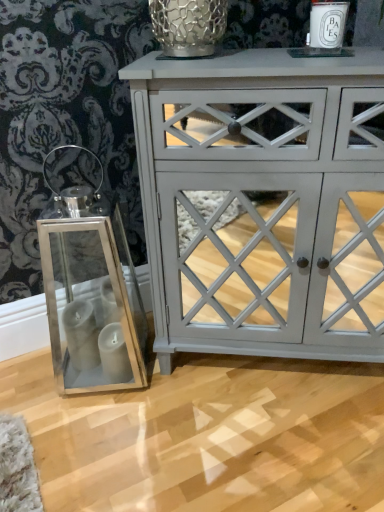
Question: Is the depth of metallic mesh glass vase at upper center less than that of matte gray cabinet at center?

Choices:
 (A) no
 (B) yes

Answer: (A)

Question: Is metallic mesh glass vase at upper center further to the viewer compared to matte gray cabinet at center?

Choices:
 (A) no
 (B) yes

Answer: (B)

Question: Does metallic mesh glass vase at upper center have a smaller size compared to matte gray cabinet at center?

Choices:
 (A) no
 (B) yes

Answer: (B)

Question: Does metallic mesh glass vase at upper center have a lesser height compared to matte gray cabinet at center?

Choices:
 (A) yes
 (B) no

Answer: (A)

Question: Can matte gray cabinet at center be found inside metallic mesh glass vase at upper center?

Choices:
 (A) yes
 (B) no

Answer: (B)

Question: Does metallic mesh glass vase at upper center touch matte gray cabinet at center?

Choices:
 (A) yes
 (B) no

Answer: (B)

Question: Can metallic mesh glass vase at upper center be found inside white ceramic candle at upper right?

Choices:
 (A) no
 (B) yes

Answer: (A)

Question: Can you confirm if white ceramic candle at upper right is shorter than metallic mesh glass vase at upper center?

Choices:
 (A) yes
 (B) no

Answer: (A)

Question: Is white ceramic candle at upper right located outside metallic mesh glass vase at upper center?

Choices:
 (A) yes
 (B) no

Answer: (A)

Question: Does white ceramic candle at upper right turn towards metallic mesh glass vase at upper center?

Choices:
 (A) yes
 (B) no

Answer: (B)

Question: Is white ceramic candle at upper right positioned before metallic mesh glass vase at upper center?

Choices:
 (A) yes
 (B) no

Answer: (A)

Question: From a real-world perspective, is white ceramic candle at upper right positioned over metallic mesh glass vase at upper center based on gravity?

Choices:
 (A) no
 (B) yes

Answer: (A)

Question: From a real-world perspective, is metallic mesh glass vase at upper center positioned over white ceramic candle at upper right based on gravity?

Choices:
 (A) no
 (B) yes

Answer: (B)